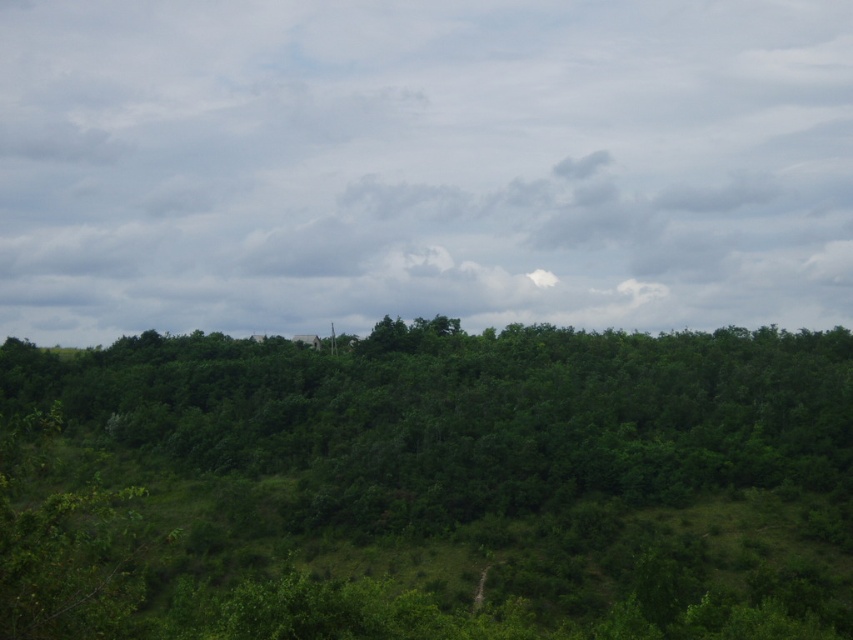
Can you confirm if cloudy sky at upper center is bigger than green leafy forest at center?

Yes, cloudy sky at upper center is bigger than green leafy forest at center.

Can you confirm if cloudy sky at upper center is positioned below green leafy forest at center?

No, cloudy sky at upper center is not below green leafy forest at center.

I want to click on cloudy sky at upper center, so click(422, 164).